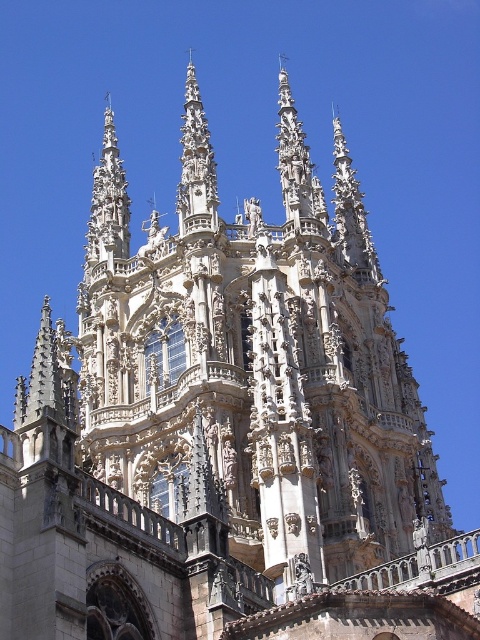
You are standing in front of the cathedral and want to take a photo of both the polished stone spire at center and the carved stone spire at upper left. Which spire should you position to your left to include both in the frame?

You should position the carved stone spire at upper left to your left because the polished stone spire at center is to the right of it, so arranging them this way will ensure both are included in the frame.

You are standing at the base of the cathedral and looking up at the facade. Which of the two spires, the polished stone spire at center or the carved stone spire at upper left, appears closer to you?

The polished stone spire at center appears closer to you because it is positioned in front of the carved stone spire at upper left.

You are an architect analyzing the cathedral design. You observe the polished stone spire at center and the carved stone spire at upper left. Which spire has a greater vertical height?

The polished stone spire at center is taller than the carved stone spire at upper left according to the description provided.